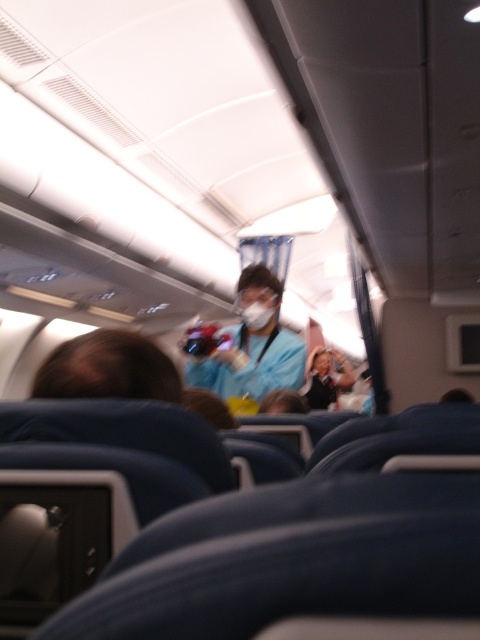
You are a passenger sitting in the airplane cabin and you see the matte blue uniform at center and the white matte mask at center. Which object is taller?

The matte blue uniform at center is much taller than the white matte mask at center.

You are seated in an airplane cabin and want to reach the flight attendant wearing the matte blue uniform at center. If you can walk 1.5 meters from your seat, can you reach them?

The matte blue uniform at center is 2.76 meters away from the viewer, which is farther than the 1.5 meters you can walk. Therefore, you cannot reach them within that distance.

You are a passenger seated in the airplane cabin and you notice the matte blue uniform at center and the white matte mask at center. Which object is closer to you?

The matte blue uniform at center is closer to you because it is in front of the white matte mask at center.